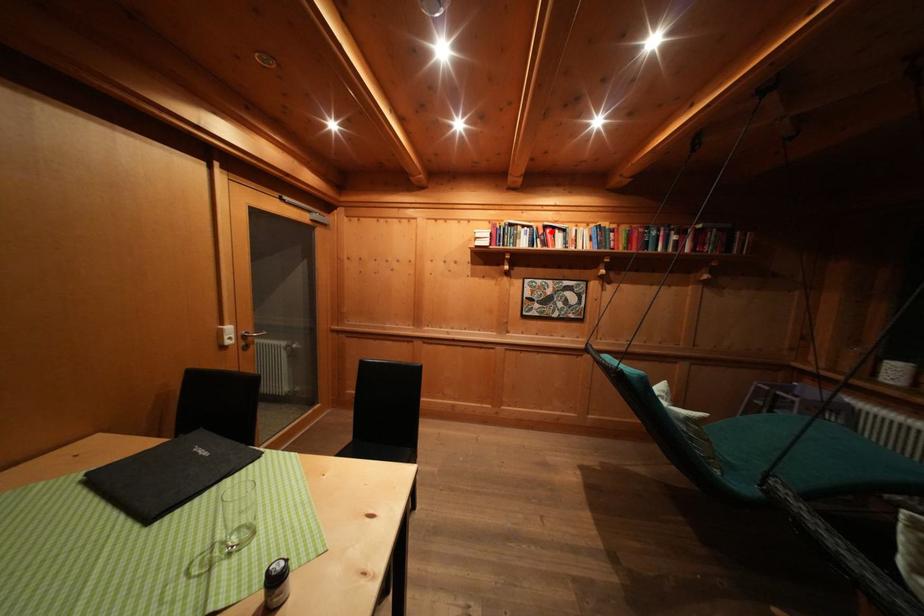
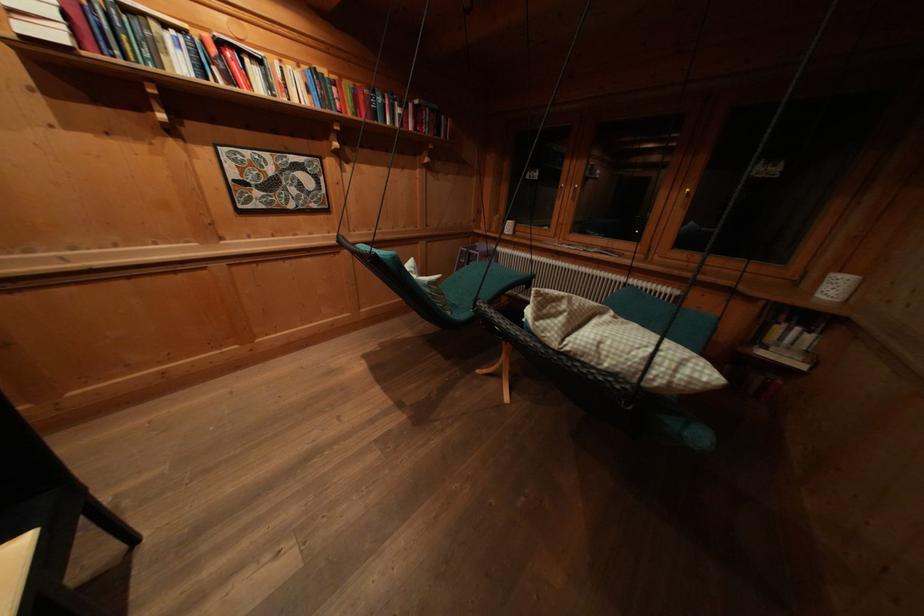
Question: I am providing you with two images of the same scene from different viewpoints. A red point is marked on the first image. Is the red point's position out of view in image 2?

Choices:
 (A) Yes
 (B) No

Answer: (B)